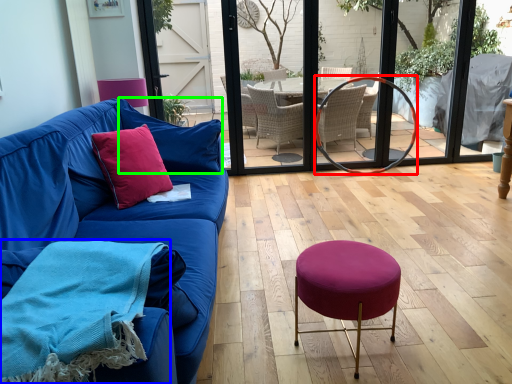
Question: Considering the real-world distances, which object is closest to oval (highlighted by a red box)? blanket (highlighted by a blue box) or pillow (highlighted by a green box).

Choices:
 (A) blanket
 (B) pillow

Answer: (B)